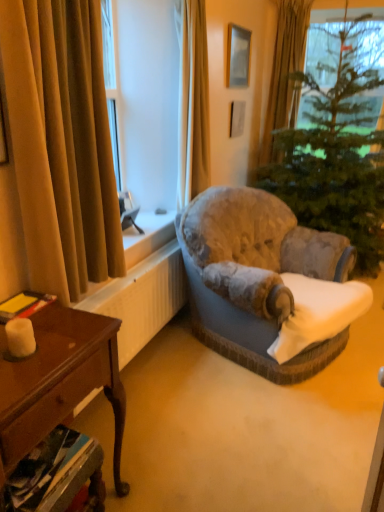
You are a GUI agent. You are given a task and a screenshot of the screen. Output one action in this format:
    pyautogui.click(x=<x>, y=<y>)
    Task: Click on the empty space that is ontop of wooden desk at lower left (from a real-world perspective)
    
    Given the screenshot: What is the action you would take?
    pyautogui.click(x=41, y=344)